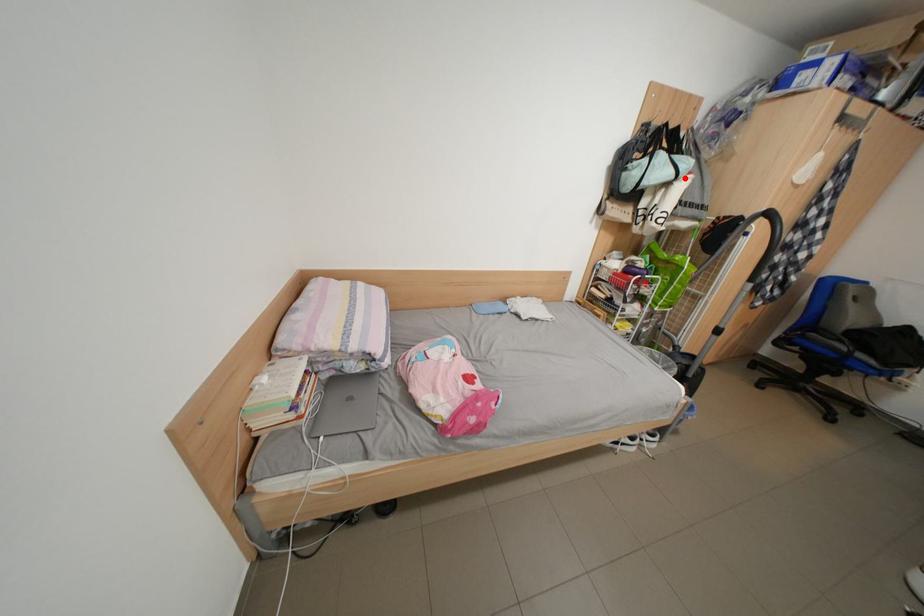
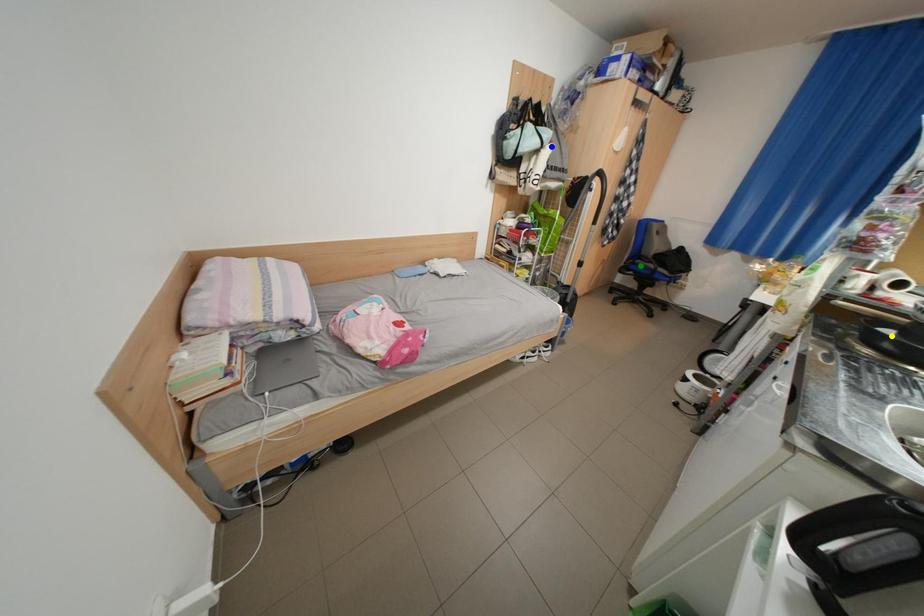
Question: I am providing you with two images of the same scene from different viewpoints. A red point is marked on the first image. You are given multiple points on the second image. Which point in image 2 is actually the same real-world point as the red point in image 1?

Choices:
 (A) yellow point
 (B) green point
 (C) blue point

Answer: (C)